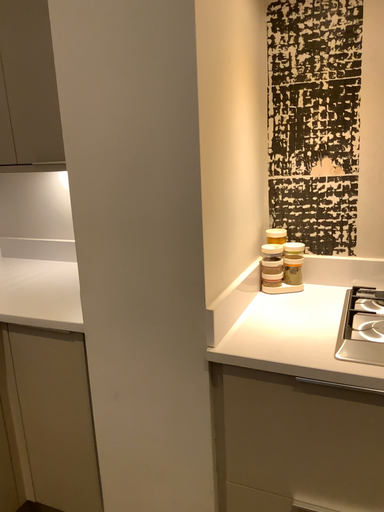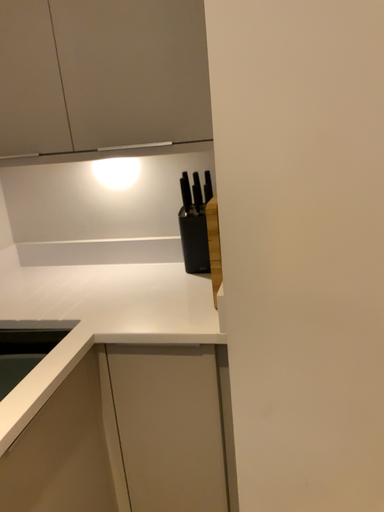
Question: Which way did the camera rotate in the video?

Choices:
 (A) rotated left
 (B) rotated right

Answer: (B)